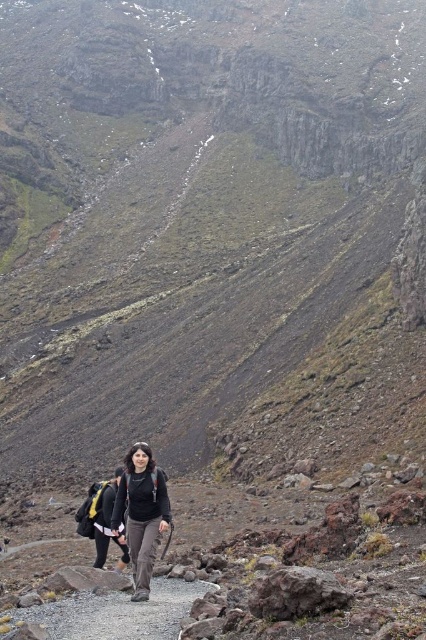
You are a hiker trying to follow the gray gravel path at center. According to the image, where is the matte black backpack at center located relative to the path?

The matte black backpack at center is behind the gray gravel path at center.

You are a hiker planning to walk along the gray gravel path at center while carrying the matte black backpack at center. Given the path width, will you have enough space to walk comfortably without touching the backpack to the path edges?

The gray gravel path at center is wider than the matte black backpack at center, so yes, you will have enough space to walk comfortably without touching the backpack to the path edges.